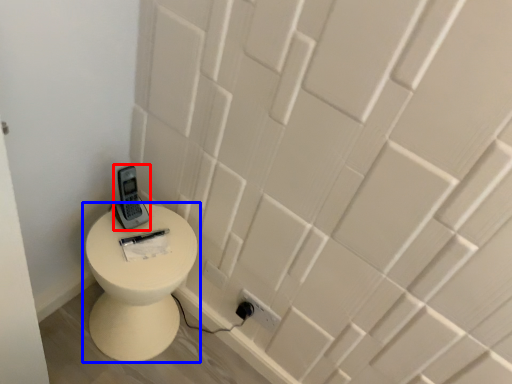
Question: Which object is further to the camera taking this photo, control (highlighted by a red box) or toilet (highlighted by a blue box)?

Choices:
 (A) control
 (B) toilet

Answer: (A)